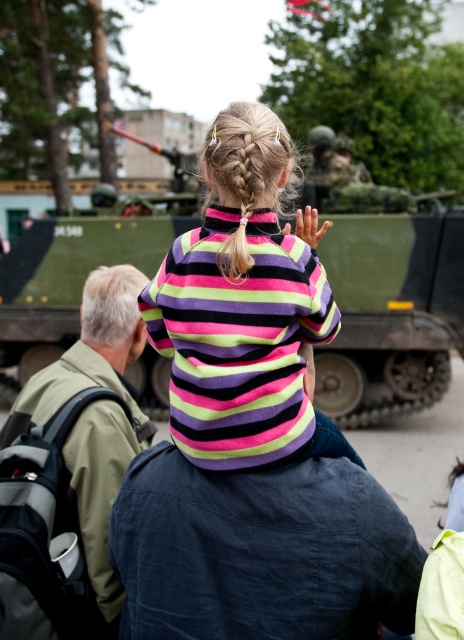
Question: Which object is positioned closest to the dark blue fabric shirt at center?

Choices:
 (A) striped jersey at center
 (B) green matte tank at center
 (C) blonde hair at upper center
 (D) green fabric backpack at upper left

Answer: (A)

Question: Can you confirm if dark blue fabric shirt at center is bigger than green matte tank at center?

Choices:
 (A) yes
 (B) no

Answer: (A)

Question: Is dark blue fabric shirt at center positioned at the back of green fabric backpack at upper left?

Choices:
 (A) no
 (B) yes

Answer: (A)

Question: Does dark blue fabric shirt at center lie behind green fabric backpack at upper left?

Choices:
 (A) no
 (B) yes

Answer: (A)

Question: Among these points, which one is nearest to the camera?

Choices:
 (A) (130, 566)
 (B) (70, 356)

Answer: (A)

Question: Which of the following is the farthest from the observer?

Choices:
 (A) (333, 333)
 (B) (100, 416)
 (C) (152, 228)
 (D) (461, 499)

Answer: (C)